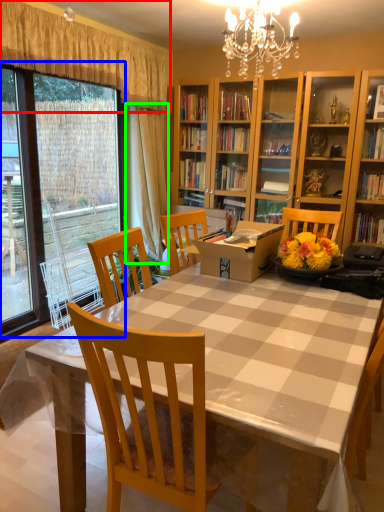
Question: Based on their relative distances, which object is farther from curtain (highlighted by a red box)? Choose from glass door (highlighted by a blue box) and curtain (highlighted by a green box).

Choices:
 (A) glass door
 (B) curtain

Answer: (A)